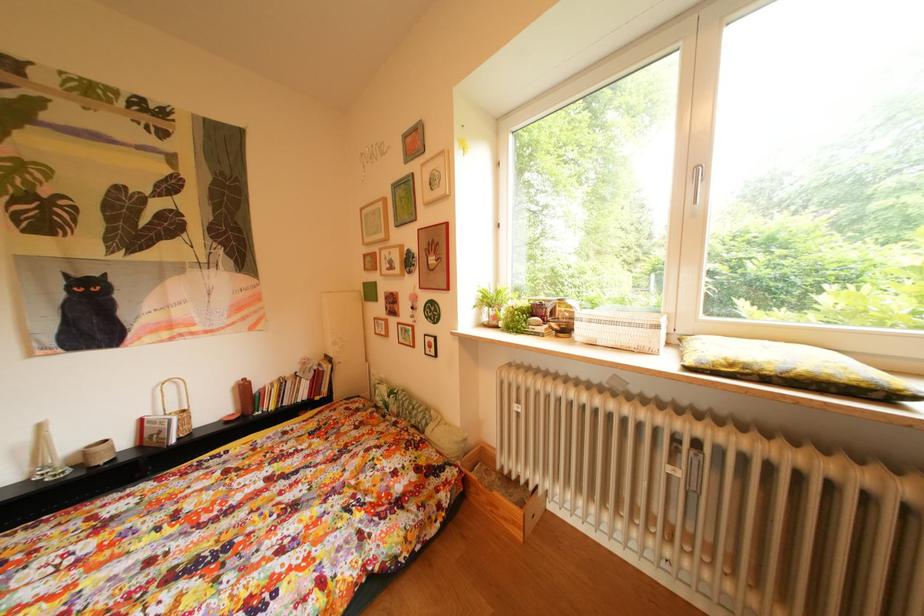
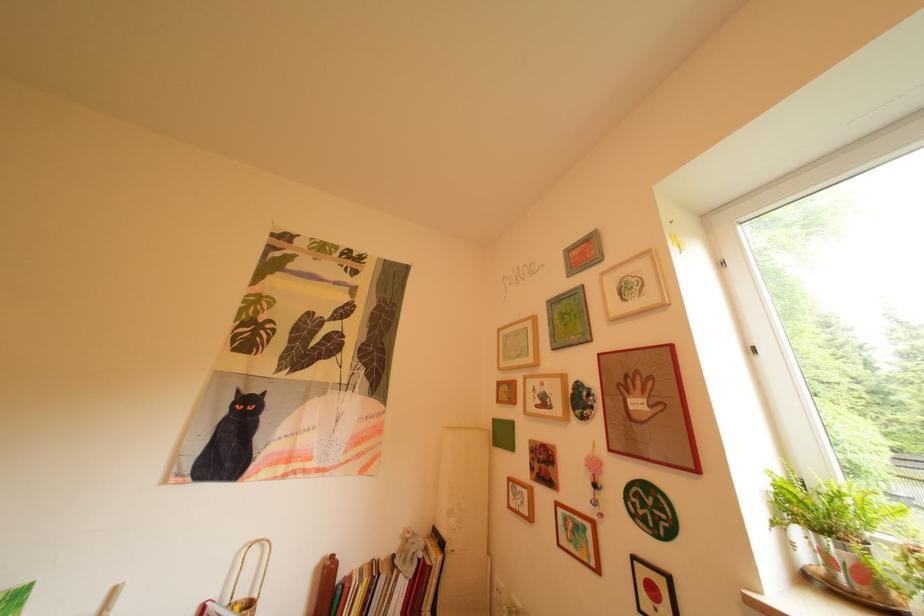
The images are taken continuously from a first-person perspective. In which direction is your viewpoint rotating?

The rotation direction of the camera is left-up.